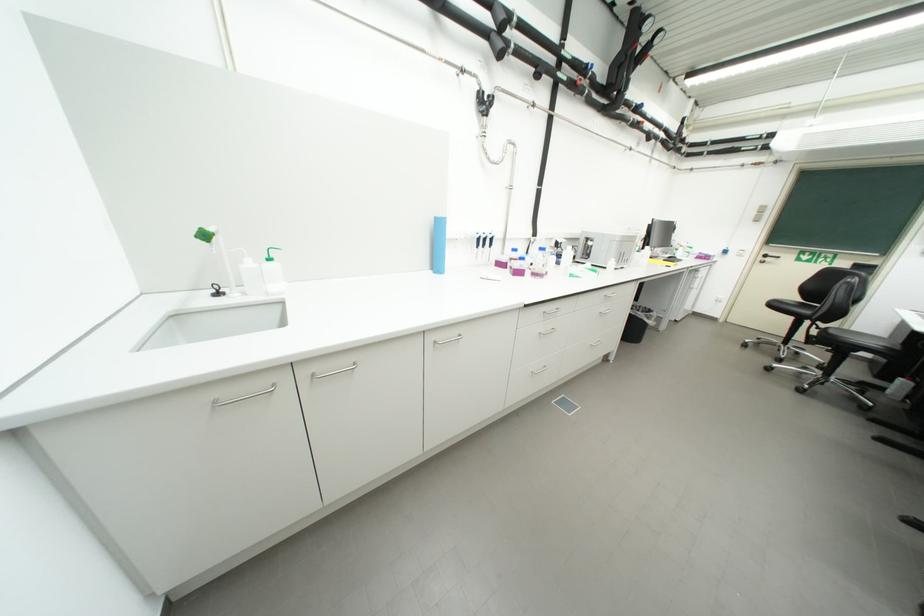
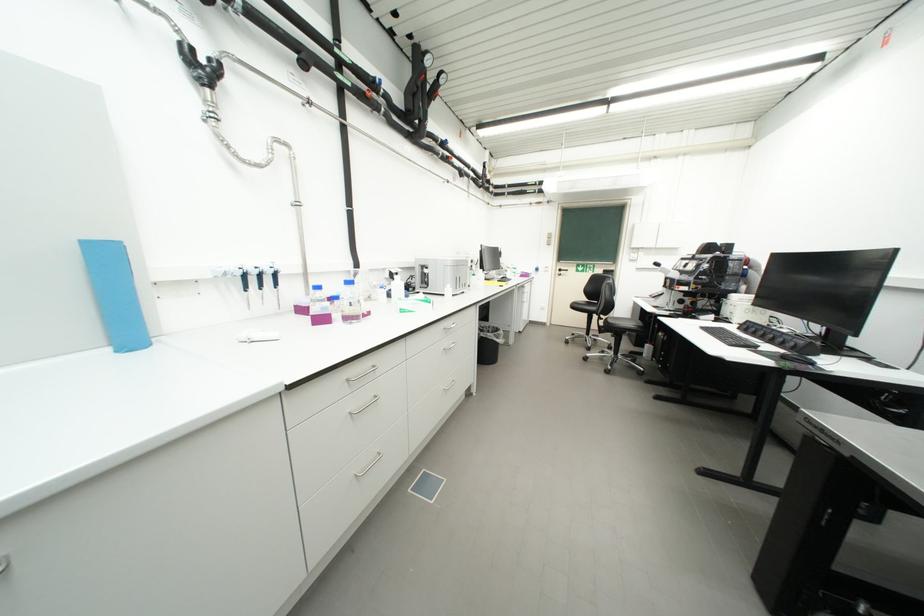
Where in the second image is the point corresponding to pixel 561 246 from the first image?

(395, 277)